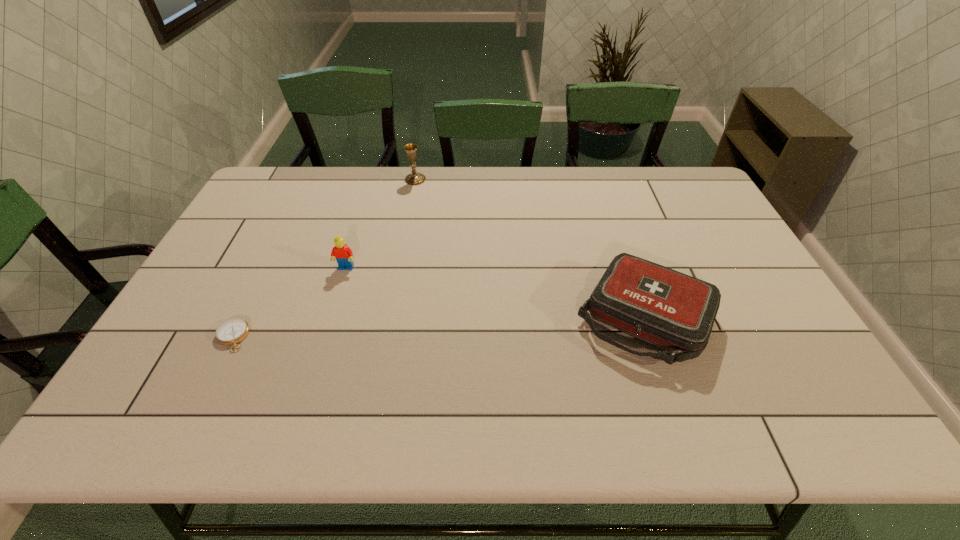
Where is `object that stands as the closest to the shortest object`? This screenshot has width=960, height=540. object that stands as the closest to the shortest object is located at coordinates (343, 254).

Where is `free location that satisfies the following two spatial constraints: 1. on the front side of the first-aid kit; 2. on the right side of the farthest object`? The image size is (960, 540). free location that satisfies the following two spatial constraints: 1. on the front side of the first-aid kit; 2. on the right side of the farthest object is located at coordinates (389, 318).

Where is `vacant area in the image that satisfies the following two spatial constraints: 1. on the face of the first-aid kit; 2. on the right side of the Lego`? vacant area in the image that satisfies the following two spatial constraints: 1. on the face of the first-aid kit; 2. on the right side of the Lego is located at coordinates (330, 318).